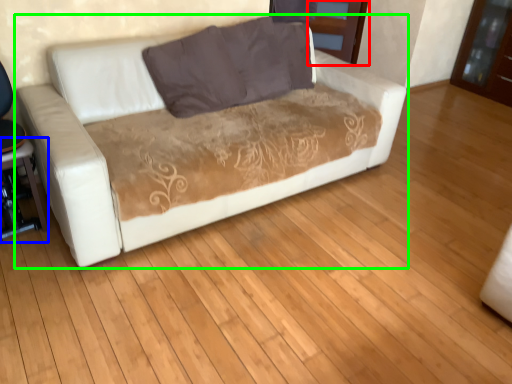
Question: Which object is the farthest from dresser (highlighted by a red box)? Choose among these: table (highlighted by a blue box) or studio couch (highlighted by a green box).

Choices:
 (A) table
 (B) studio couch

Answer: (A)